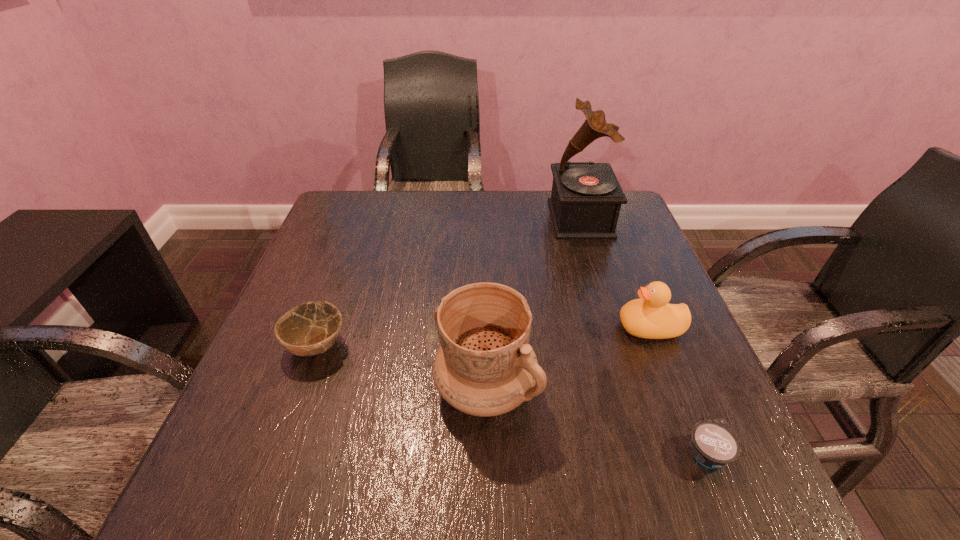
Where is `phonograph_record`? The height and width of the screenshot is (540, 960). phonograph_record is located at coordinates (586, 198).

This screenshot has height=540, width=960. What are the coordinates of `the farthest object` in the screenshot? It's located at (586, 198).

This screenshot has height=540, width=960. In order to click on pottery in this screenshot , I will do `click(485, 366)`.

In order to click on the fourth object from right to left in this screenshot , I will do `click(485, 366)`.

Image resolution: width=960 pixels, height=540 pixels. I want to click on duck, so click(x=652, y=317).

This screenshot has width=960, height=540. In order to click on bowl in this screenshot , I will do `click(308, 329)`.

Where is `the leftmost object`? This screenshot has width=960, height=540. the leftmost object is located at coordinates (308, 329).

The height and width of the screenshot is (540, 960). I want to click on yogurt, so click(x=713, y=444).

At what (x,y) coordinates should I click in order to perform the action: click on vacant space located at the horn opening of the phonograph_record. Please return your answer as a coordinate pair (x, y). Looking at the image, I should click on (414, 219).

Locate an element on the screen. Image resolution: width=960 pixels, height=540 pixels. vacant space located at the horn opening of the phonograph_record is located at coordinates (518, 219).